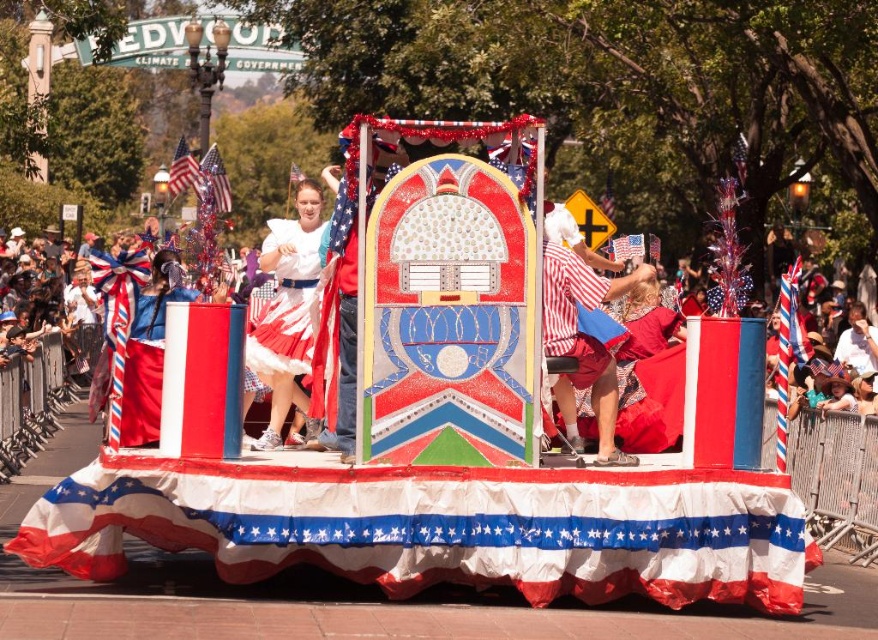
The image size is (878, 640). I want to click on white striped fabric at center, so click(x=584, y=337).

This screenshot has width=878, height=640. In order to click on white striped fabric at center in this screenshot , I will do `click(584, 337)`.

Who is positioned more to the right, white striped fabric at center or red fabric flag at upper left?

white striped fabric at center

Consider the image. Does white striped fabric at center appear over red fabric flag at upper left?

No, white striped fabric at center is not above red fabric flag at upper left.

Does point (637, 275) come behind point (193, 160)?

No, (637, 275) is in front of (193, 160).

Identify the location of white striped fabric at center. (584, 337).

Can you confirm if white satin dress at center is shorter than striped barber pole at center?

Correct, white satin dress at center is not as tall as striped barber pole at center.

Which is more to the right, white satin dress at center or striped barber pole at center?

striped barber pole at center

Is point (306, 291) positioned before point (779, 346)?

Yes.

Where is `white satin dress at center`? This screenshot has width=878, height=640. white satin dress at center is located at coordinates [x=286, y=304].